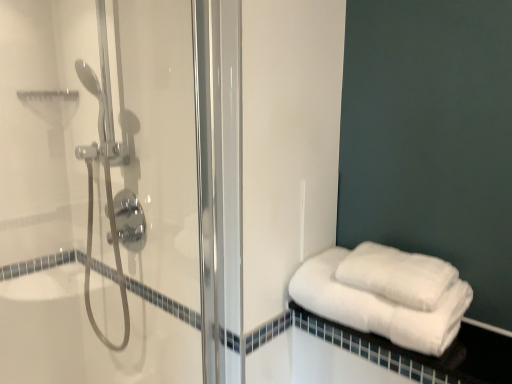
Identify the location of vacant area on top of white fluffy towels at lower right, the 1th towel from the top (from a real-world perspective). This screenshot has width=512, height=384. (387, 253).